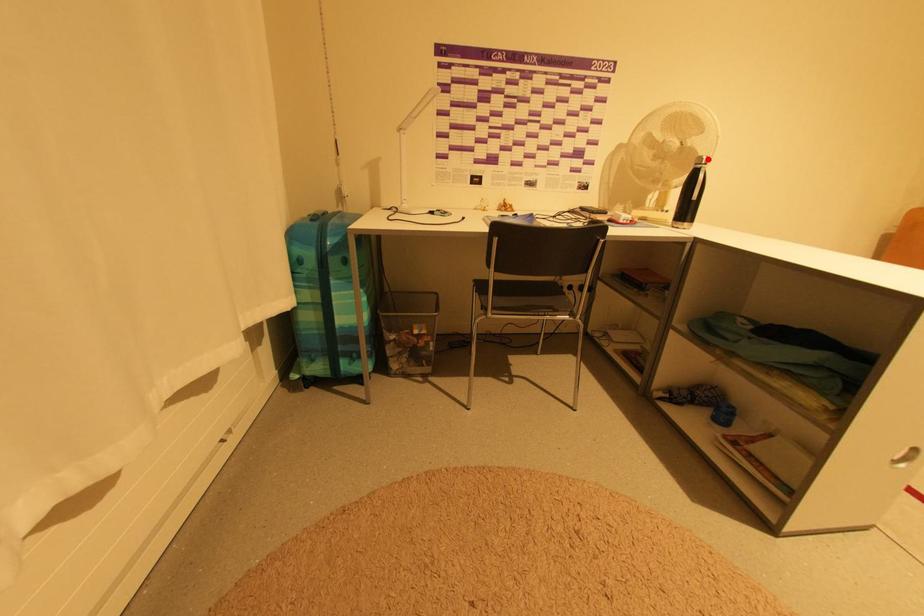
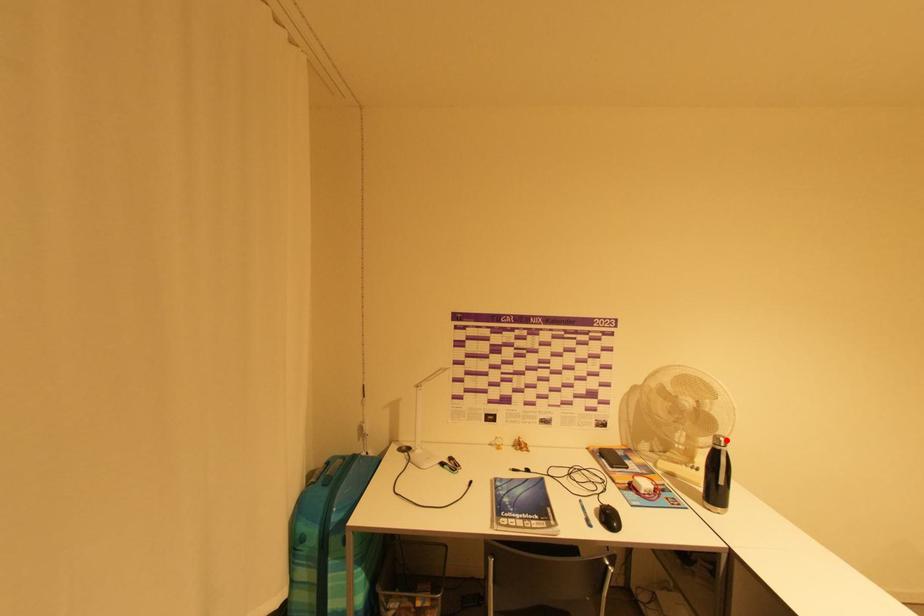
I am providing you with two images of the same scene from different viewpoints. A red point is marked on the first image and another point is marked on the second image. Is the marked point in image1 the same physical position as the marked point in image2?

Yes